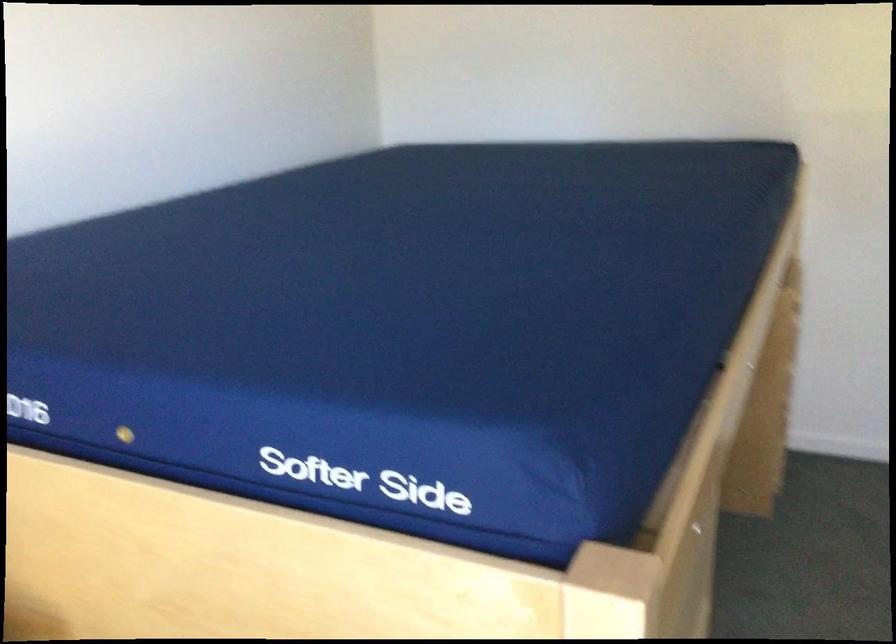
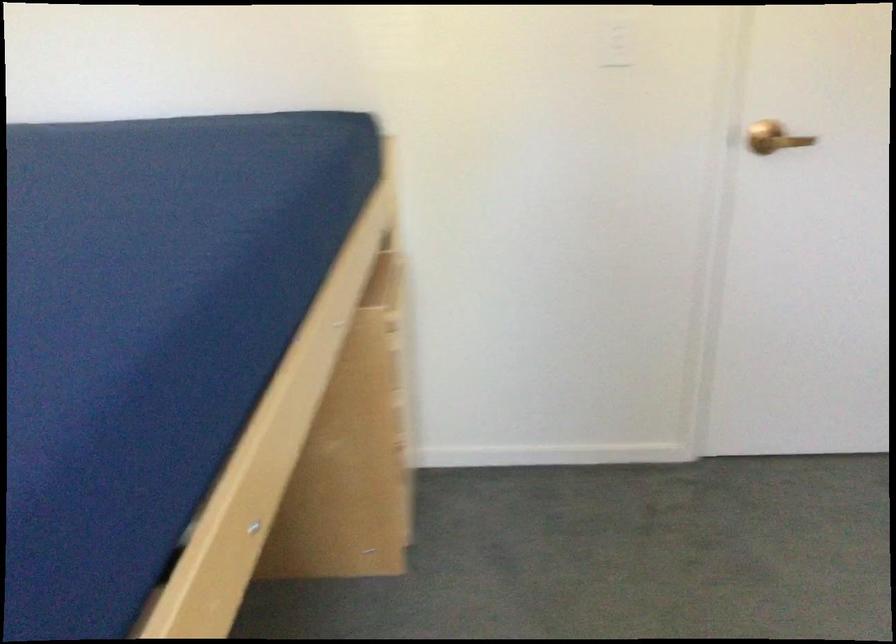
The images are taken continuously from a first-person perspective. In which direction are you moving?

The movement direction of the cameraman is right, forward.